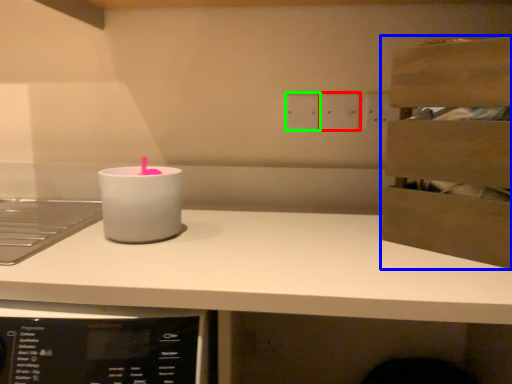
Question: Which object is the farthest from electric outlet (highlighted by a red box)? Choose among these: cabinetry (highlighted by a blue box) or electric outlet (highlighted by a green box).

Choices:
 (A) cabinetry
 (B) electric outlet

Answer: (A)